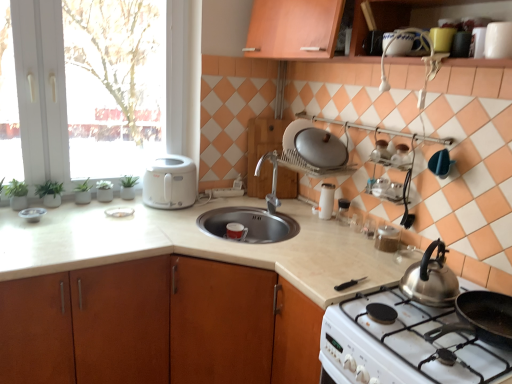
Image resolution: width=512 pixels, height=384 pixels. What are the coordinates of `free space in front of white glossy plate at left, acting as the fourth appliance starting from the bottom` in the screenshot? It's located at (106, 221).